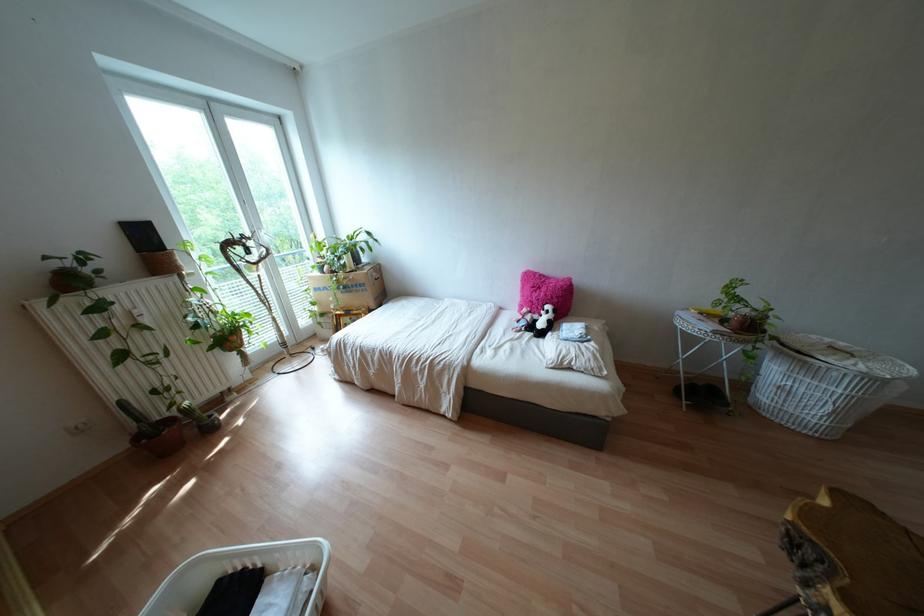
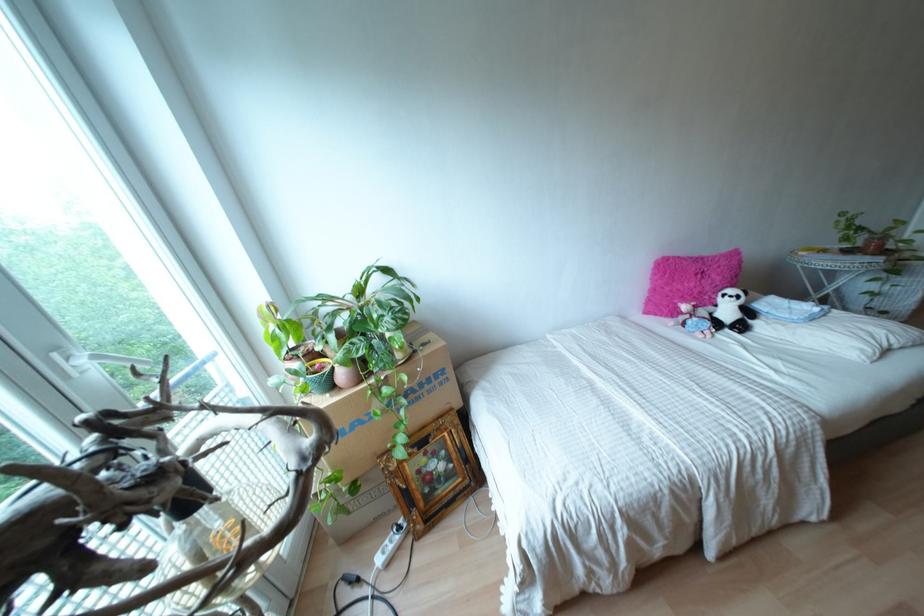
Find the pixel in the second image that matches (x=551, y=326) in the first image.

(747, 312)